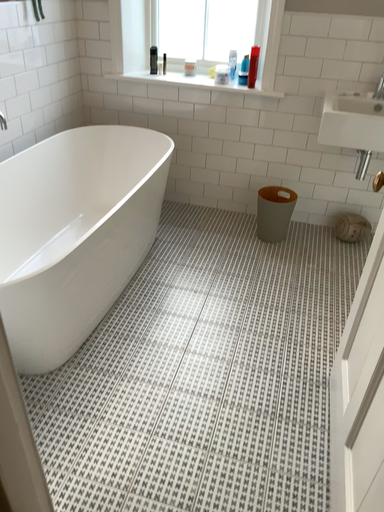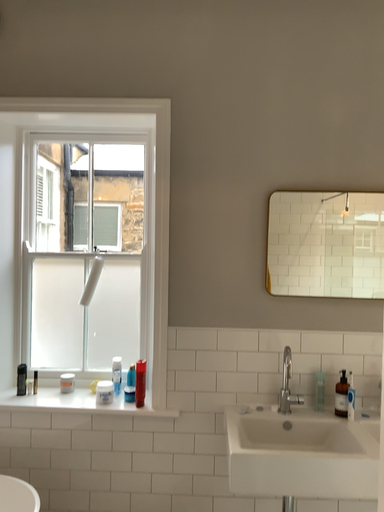
Question: How did the camera likely rotate when shooting the video?

Choices:
 (A) rotated left
 (B) rotated right

Answer: (B)